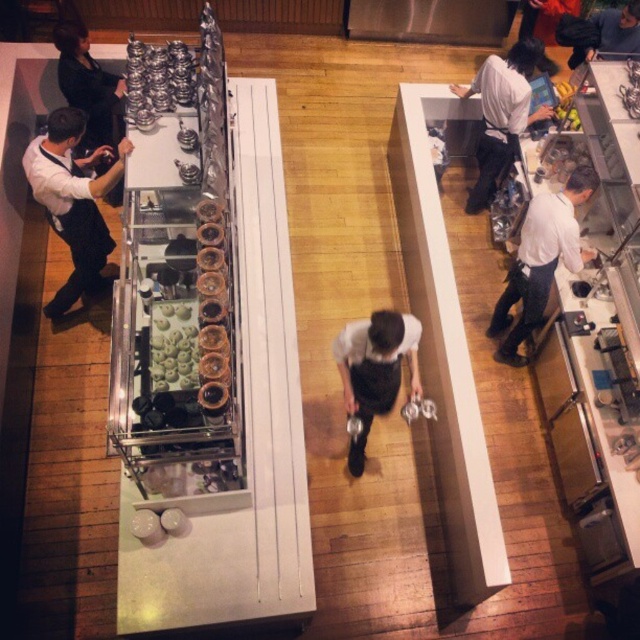
Question: Which object appears closest to the camera in this image?

Choices:
 (A) white apron at right
 (B) black matte apron at center
 (C) dark blue sweater at upper right

Answer: (B)

Question: Does white shirt at right have a lesser width compared to dark brown leather jacket at upper left?

Choices:
 (A) yes
 (B) no

Answer: (B)

Question: Can you confirm if white shirt at right is wider than dark brown leather jacket at upper left?

Choices:
 (A) yes
 (B) no

Answer: (A)

Question: Considering the real-world distances, which object is farthest from the white shirt at left?

Choices:
 (A) dark brown leather jacket at upper left
 (B) white shirt at right
 (C) white apron at right

Answer: (C)

Question: Among these points, which one is nearest to the camera?

Choices:
 (A) (358, 353)
 (B) (486, 179)

Answer: (A)

Question: Is white apron at right below dark brown leather jacket at upper left?

Choices:
 (A) yes
 (B) no

Answer: (A)